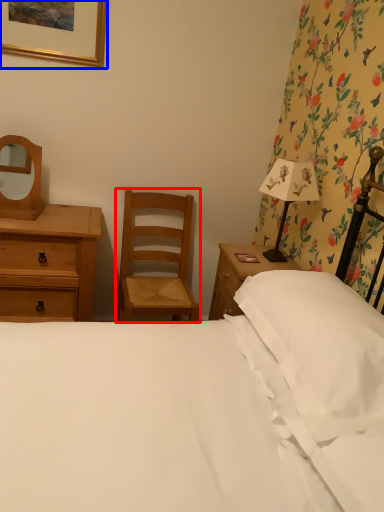
Question: Which of the following is the farthest to the observer, chair (highlighted by a red box) or picture frame (highlighted by a blue box)?

Choices:
 (A) chair
 (B) picture frame

Answer: (A)